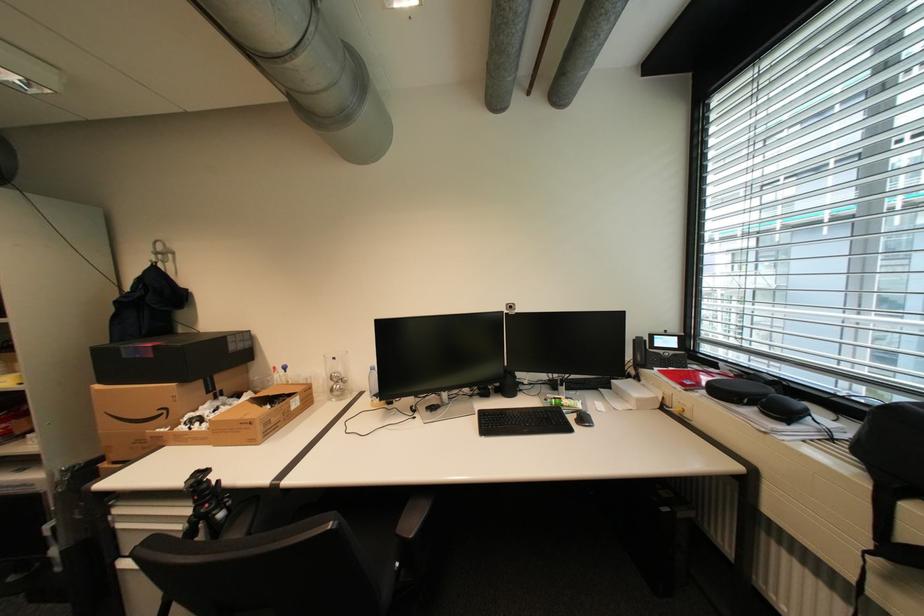
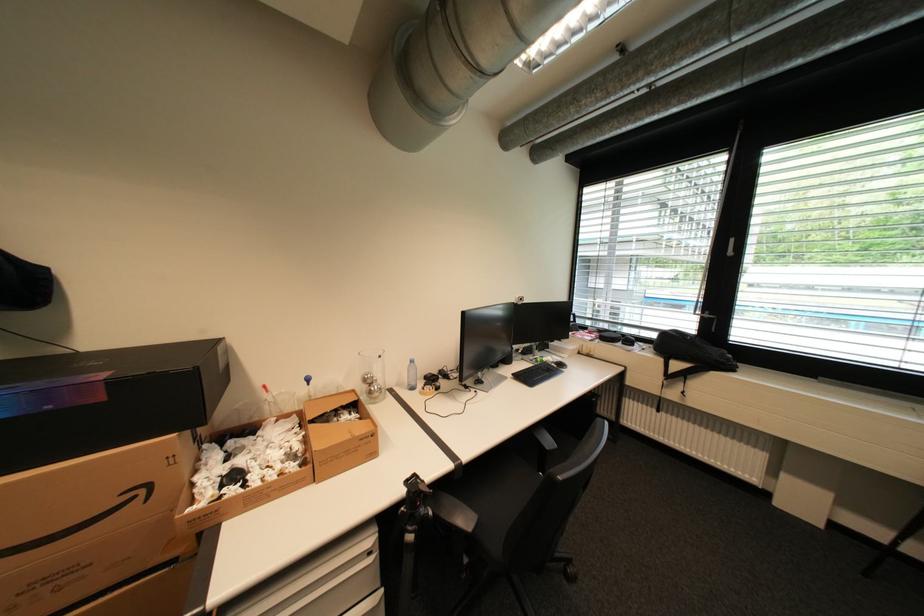
Locate, in the second image, the point that corresponds to [343,376] in the first image.

(377, 378)